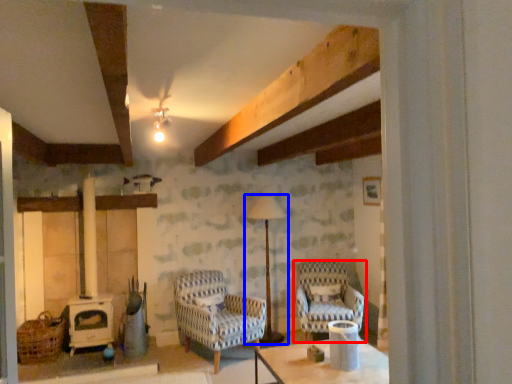
Question: Which point is further to the camera, chair (highlighted by a red box) or lamp (highlighted by a blue box)?

Choices:
 (A) chair
 (B) lamp

Answer: (B)